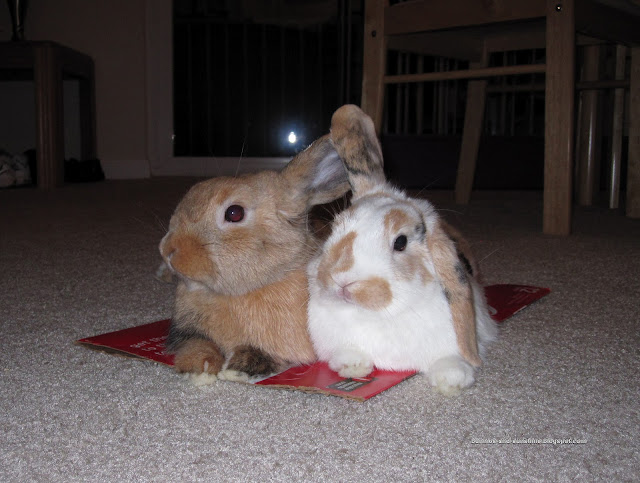
The image size is (640, 483). In order to click on glass door behind rabbits in this screenshot , I will do `click(256, 83)`.